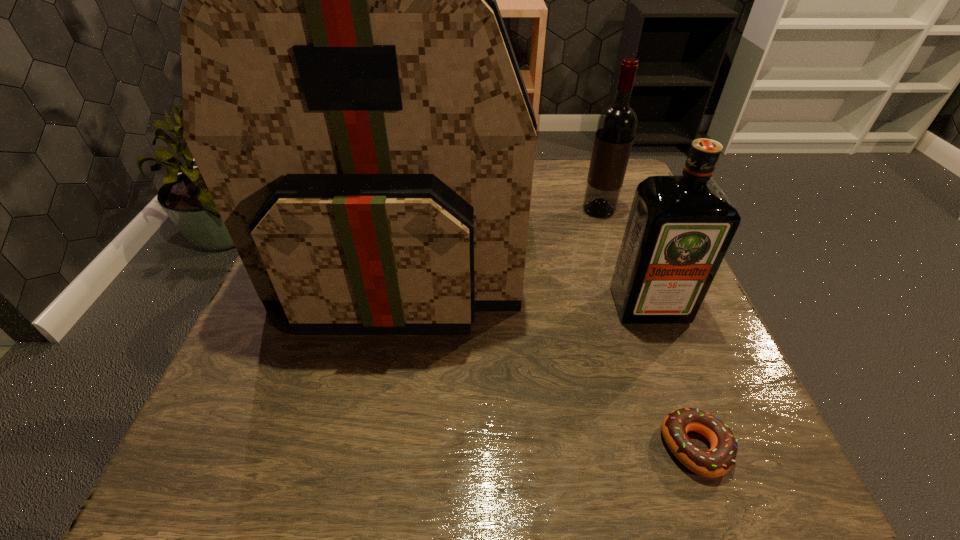
The height and width of the screenshot is (540, 960). In order to click on backpack in this screenshot , I will do `click(351, 97)`.

This screenshot has width=960, height=540. In order to click on the tallest object in this screenshot , I will do `click(351, 97)`.

The height and width of the screenshot is (540, 960). What are the coordinates of `wine bottle` in the screenshot? It's located at (616, 127).

Locate an element on the screen. The height and width of the screenshot is (540, 960). liquor is located at coordinates (679, 228).

The image size is (960, 540). I want to click on doughnut, so click(x=717, y=461).

Where is `the nearest object`? The width and height of the screenshot is (960, 540). the nearest object is located at coordinates (717, 461).

Identify the location of free region located on the front face of the backpack. This screenshot has height=540, width=960. (364, 458).

Identify the location of vacant point located on the left of the wine bottle. The height and width of the screenshot is (540, 960). (544, 210).

Identify the location of vacant area situated 0.100m on the front label of the liquor. The height and width of the screenshot is (540, 960). (675, 372).

I want to click on vacant region located 0.140m on the left of the shortest object, so click(564, 447).